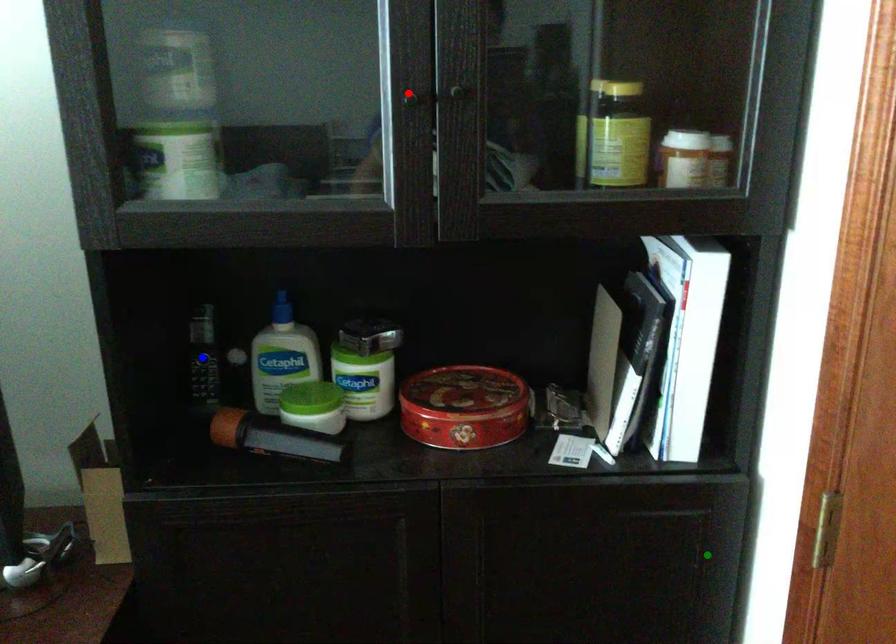
Order these from nearest to farthest:
A) red point
B) green point
C) blue point

1. red point
2. green point
3. blue point